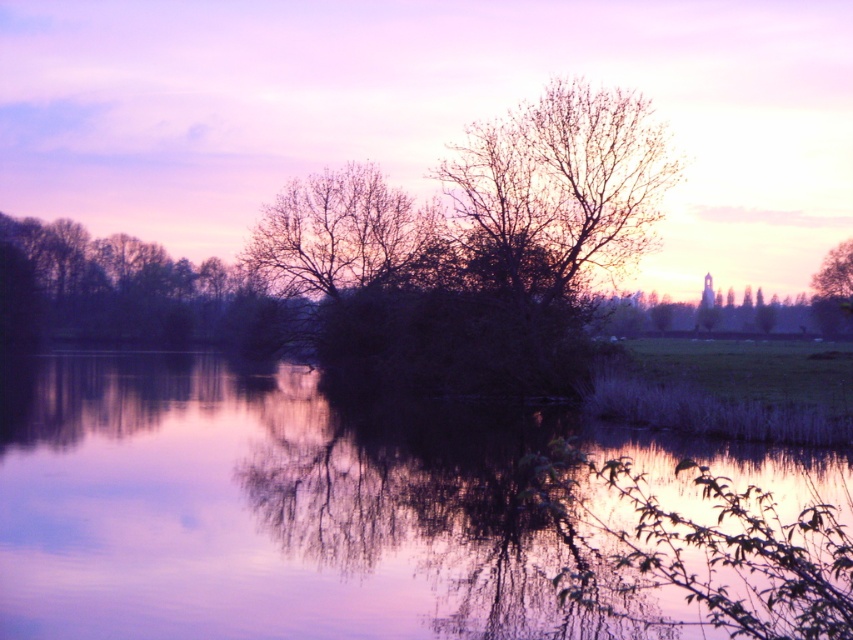
Is purple reflective water at center to the right of green matte tree at upper right from the viewer's perspective?

Incorrect, purple reflective water at center is not on the right side of green matte tree at upper right.

Can you confirm if purple reflective water at center is smaller than green matte tree at upper right?

No, purple reflective water at center is not smaller than green matte tree at upper right.

Is point (593, 486) farther from camera compared to point (849, 307)?

That is False.

What are the coordinates of `purple reflective water at center` in the screenshot? It's located at click(x=300, y=504).

Does silhouette bare tree at left appear under green matte tree at upper right?

Yes.

Is silhouette bare tree at left to the left of green matte tree at upper right from the viewer's perspective?

Yes, silhouette bare tree at left is to the left of green matte tree at upper right.

What are the coordinates of `silhouette bare tree at left` in the screenshot? It's located at (128, 291).

You are a GUI agent. You are given a task and a screenshot of the screen. Output one action in this format:
    pyautogui.click(x=<x>, y=<y>)
    Task: Click on the silhouette bare tree at left
    This screenshot has height=640, width=853.
    Given the screenshot: What is the action you would take?
    pyautogui.click(x=128, y=291)

Is silhouette bare tree at left bigger than bare branches at center?

Correct, silhouette bare tree at left is larger in size than bare branches at center.

How far apart are silhouette bare tree at left and bare branches at center?

silhouette bare tree at left and bare branches at center are 35.50 feet apart.

Between point (248, 292) and point (418, 228), which one is positioned in front?

Point (418, 228)

Locate an element on the screen. Image resolution: width=853 pixels, height=640 pixels. silhouette bare tree at left is located at coordinates click(x=128, y=291).